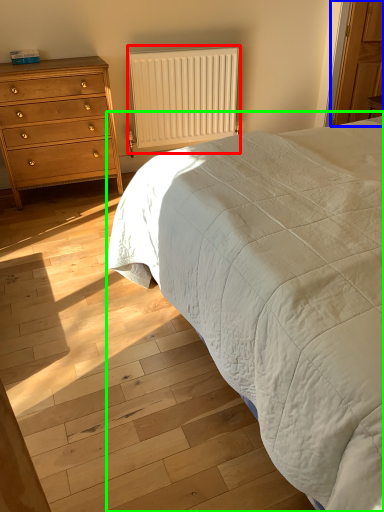
Question: Which object is the closest to the radiator (highlighted by a red box)? Choose among these: armoire (highlighted by a blue box) or bed (highlighted by a green box).

Choices:
 (A) armoire
 (B) bed

Answer: (A)